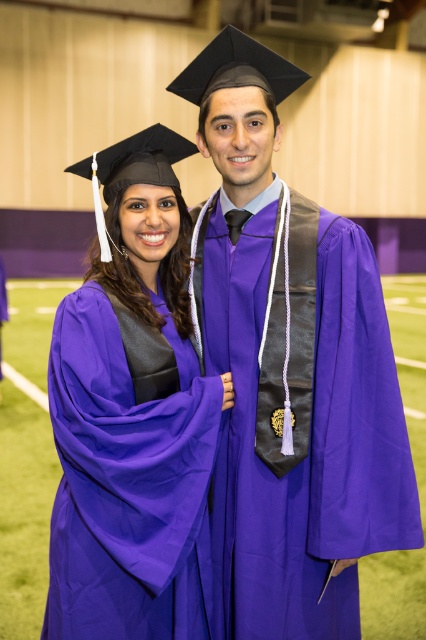
You are a photographer at a graduation ceremony. You need to adjust the camera angle so that both the purple matte graduation gown at center and the purple matte graduation gown at left appear equally tall in the photo. What adjustment should you make?

The purple matte graduation gown at center is much taller than the purple matte graduation gown at left. To make them appear equally tall in the photo, you should lower the camera angle to compensate for the height difference.